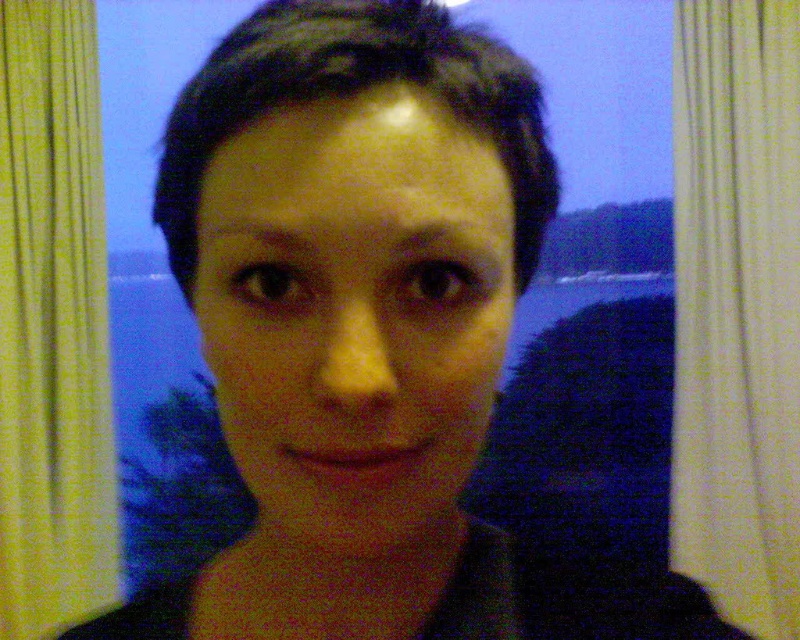
You are planning to hang a new decorative item on the wall between the yellow fabric curtain at left and the yellow textured curtain at left. Based on their positions, which curtain should you place the item closer to if you want it to be at a lower height?

The yellow fabric curtain at left is below the yellow textured curtain at left, so placing the decorative item closer to the yellow fabric curtain at left would position it at a lower height.

You are a photographer setting up a shot for a magazine. You want to highlight the contrast between the warm indoor lighting and the cool twilight outside. Which curtain on the left side should you adjust to better frame the scene, the yellow fabric curtain at left or the yellow textured curtain at left?

The yellow fabric curtain at left is shorter than the yellow textured curtain at left, so adjusting the taller yellow textured curtain at left would better frame the scene by allowing more of the twilight view to be visible while maintaining the contrast between indoor and outdoor elements.

You are taking a selfie and want to focus on the point at the top center of the frame. Which of the two points, point at (776, 346) or point at (40, 84), is closer to the camera and thus better for focusing?

Point at (776, 346) is closer to the camera than point at (40, 84), so it is better for focusing.